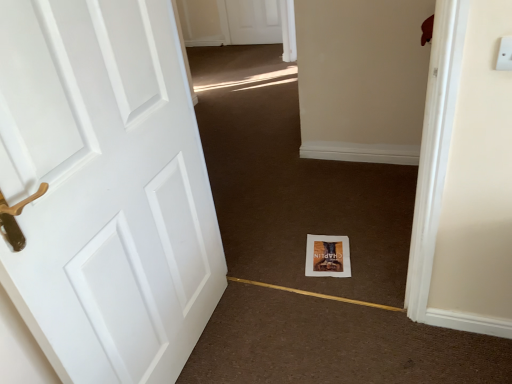
You are a GUI agent. You are given a task and a screenshot of the screen. Output one action in this format:
    pyautogui.click(x=<x>, y=<y>)
    Task: Click on the unoccupied area behind matte paper book at center
    This screenshot has height=384, width=512.
    Given the screenshot: What is the action you would take?
    pyautogui.click(x=327, y=224)